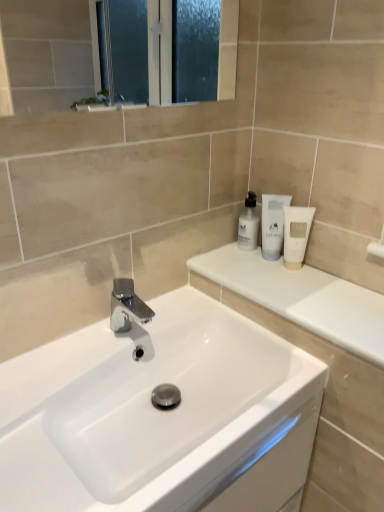
I want to click on free space above white glossy countertop at upper right (from a real-world perspective), so click(299, 286).